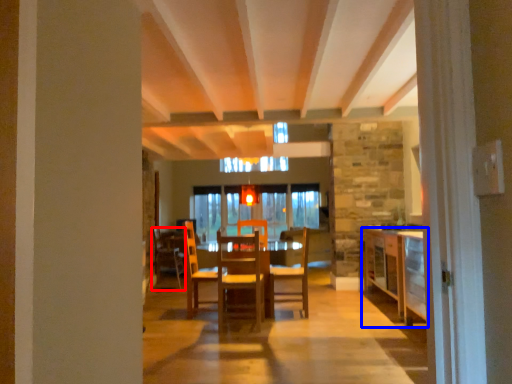
Question: Which of the following is the farthest to the observer, chair (highlighted by a red box) or cabinetry (highlighted by a blue box)?

Choices:
 (A) chair
 (B) cabinetry

Answer: (A)